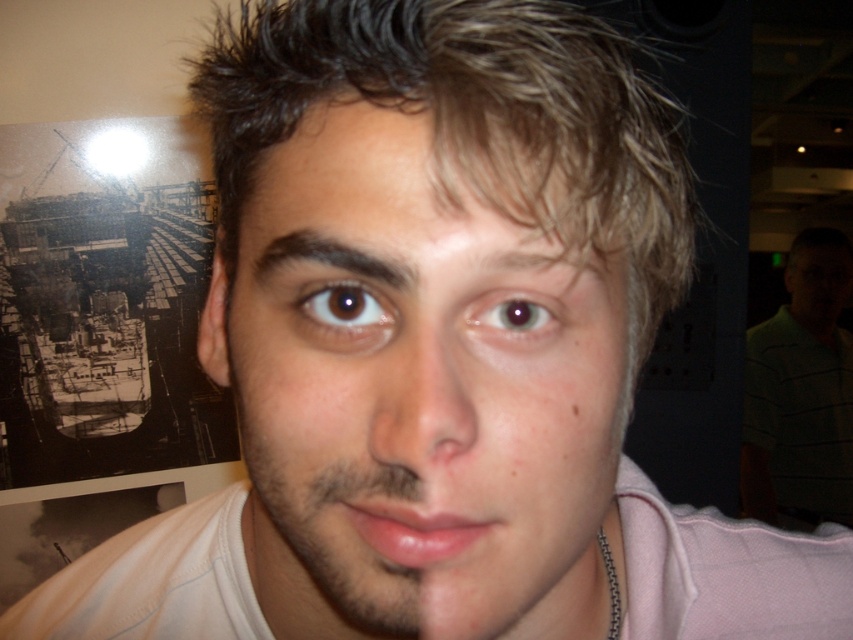
You are a fashion designer analyzing the image. You need to determine if the green striped shirt at right can be seen from the front view of the brown glossy eye at center. Can you confirm this?

The green striped shirt at right is bigger than brown glossy eye at center, but the question of visibility from the front view isn

In the scene shown: You are a photographer who wants to focus on the smooth skin nose at center in the image. Where exactly should you adjust the camera focus to capture it precisely?

The smooth skin nose at center is located at point coordinates of (x=426, y=400), so you should adjust the camera focus to that exact point to capture it precisely.